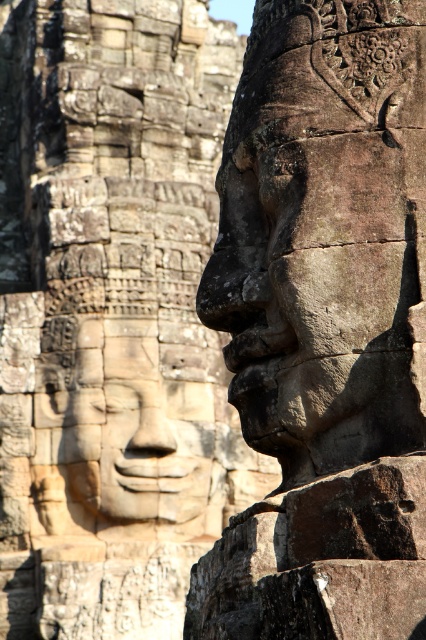
Can you confirm if weathered stone face at center is positioned to the right of smooth stone face at center?

Indeed, weathered stone face at center is positioned on the right side of smooth stone face at center.

Who is positioned more to the right, weathered stone face at center or smooth stone face at center?

weathered stone face at center is more to the right.

Between point (261, 49) and point (175, 461), which one is positioned in front?

Point (261, 49) is more forward.

You are a GUI agent. You are given a task and a screenshot of the screen. Output one action in this format:
    pyautogui.click(x=<x>, y=<y>)
    Task: Click on the weathered stone face at center
    The width and height of the screenshot is (426, 640).
    Given the screenshot: What is the action you would take?
    pyautogui.click(x=325, y=234)